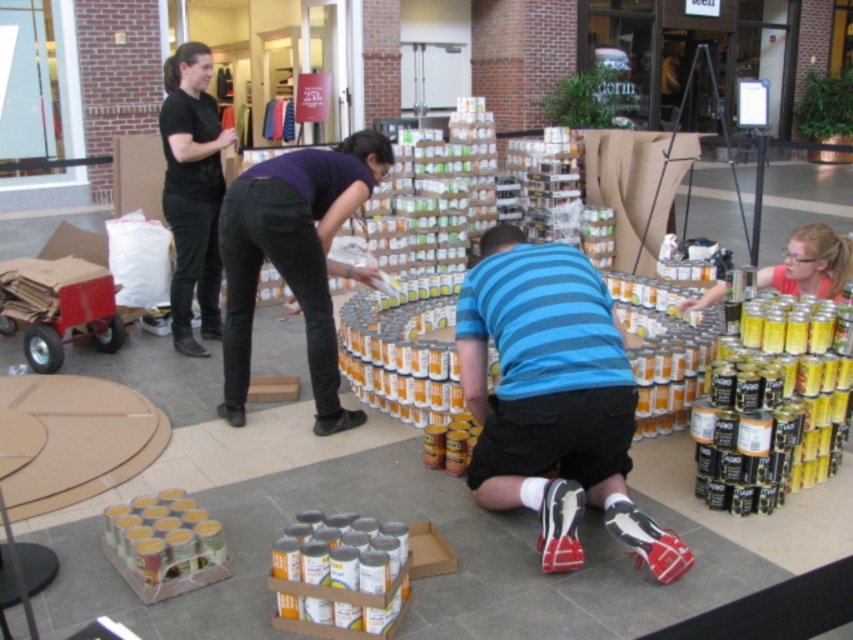
Question: Where is purple matte shirt at center located in relation to matte yellow can at center in the image?

Choices:
 (A) below
 (B) above

Answer: (B)

Question: Is blue striped shirt at center thinner than purple matte shirt at center?

Choices:
 (A) no
 (B) yes

Answer: (B)

Question: Which of the following is the closest to the observer?

Choices:
 (A) (775, 268)
 (B) (303, 176)

Answer: (B)

Question: Does purple matte shirt at center lie behind black matte pants at upper left?

Choices:
 (A) no
 (B) yes

Answer: (A)

Question: Which is nearer to the matte yellow can at center?

Choices:
 (A) purple matte shirt at center
 (B) black matte pants at upper left
 (C) blue striped shirt at center

Answer: (C)

Question: Estimate the real-world distances between objects in this image. Which object is farther from the purple matte shirt at center?

Choices:
 (A) black matte pants at upper left
 (B) matte yellow can at center
 (C) blue striped shirt at center

Answer: (B)